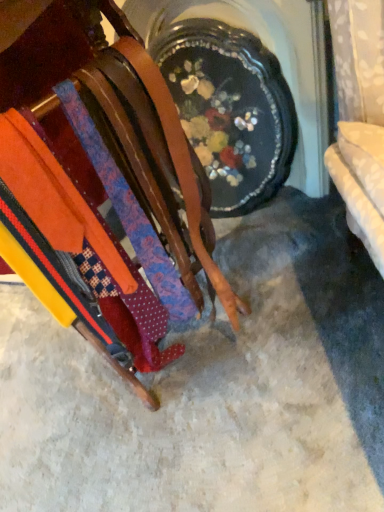
Question: Is point (41, 195) positioned closer to the camera than point (31, 373)?

Choices:
 (A) farther
 (B) closer

Answer: (B)

Question: Is wooden rack of ties at center wider or thinner than orange fabric at left?

Choices:
 (A) thin
 (B) wide

Answer: (A)

Question: Is wooden rack of ties at center inside the boundaries of orange fabric at left, or outside?

Choices:
 (A) outside
 (B) inside

Answer: (A)

Question: From a real-world perspective, relative to wooden rack of ties at center, is orange fabric at left vertically above or below?

Choices:
 (A) below
 (B) above

Answer: (A)

Question: From the image's perspective, is orange fabric at left above or below wooden rack of ties at center?

Choices:
 (A) above
 (B) below

Answer: (B)

Question: Is orange fabric at left spatially inside wooden rack of ties at center, or outside of it?

Choices:
 (A) inside
 (B) outside

Answer: (B)

Question: In terms of width, does orange fabric at left look wider or thinner when compared to wooden rack of ties at center?

Choices:
 (A) wide
 (B) thin

Answer: (A)